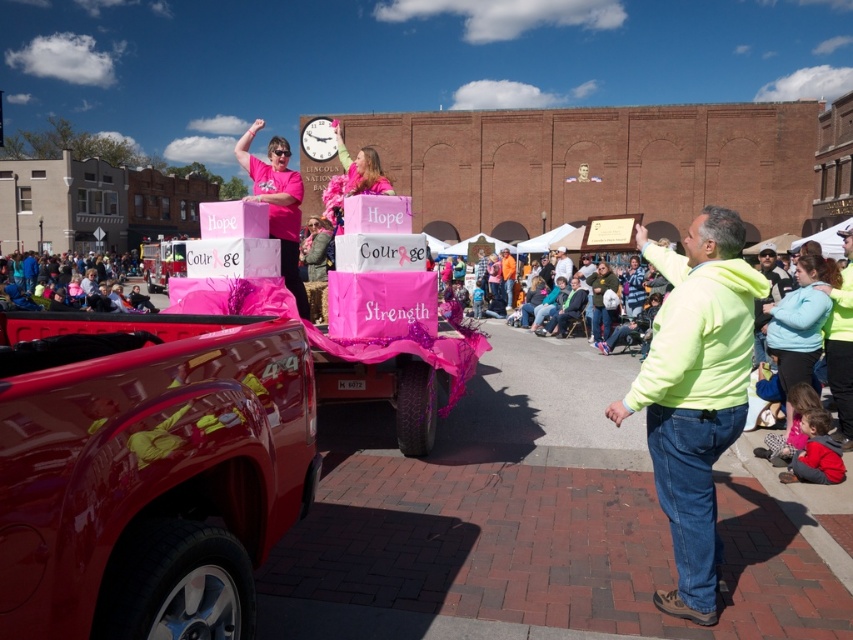
Which is in front, point (704, 257) or point (607, 330)?

Point (704, 257) is more forward.

Is neon yellow fleece at center to the left of matte pink shirt at center from the viewer's perspective?

Correct, you'll find neon yellow fleece at center to the left of matte pink shirt at center.

The height and width of the screenshot is (640, 853). Describe the element at coordinates (695, 394) in the screenshot. I see `neon yellow fleece at center` at that location.

The height and width of the screenshot is (640, 853). Identify the location of neon yellow fleece at center. (695, 394).

Between shiny red truck at lower left and matte pink shirt at center, which one has less height?

Standing shorter between the two is shiny red truck at lower left.

Does shiny red truck at lower left appear under matte pink shirt at center?

Indeed, shiny red truck at lower left is positioned under matte pink shirt at center.

I want to click on shiny red truck at lower left, so click(149, 476).

Measure the distance between point (x=219, y=563) and camera.

A distance of 2.25 meters exists between point (x=219, y=563) and camera.

Between shiny red truck at lower left and pink fabric crowd at lower left, which one is positioned higher?

pink fabric crowd at lower left

You are a GUI agent. You are given a task and a screenshot of the screen. Output one action in this format:
    pyautogui.click(x=<x>, y=<y>)
    Task: Click on the shiny red truck at lower left
    This screenshot has height=640, width=853.
    Given the screenshot: What is the action you would take?
    pyautogui.click(x=149, y=476)

Locate an element on the screen. This screenshot has width=853, height=640. shiny red truck at lower left is located at coordinates (149, 476).